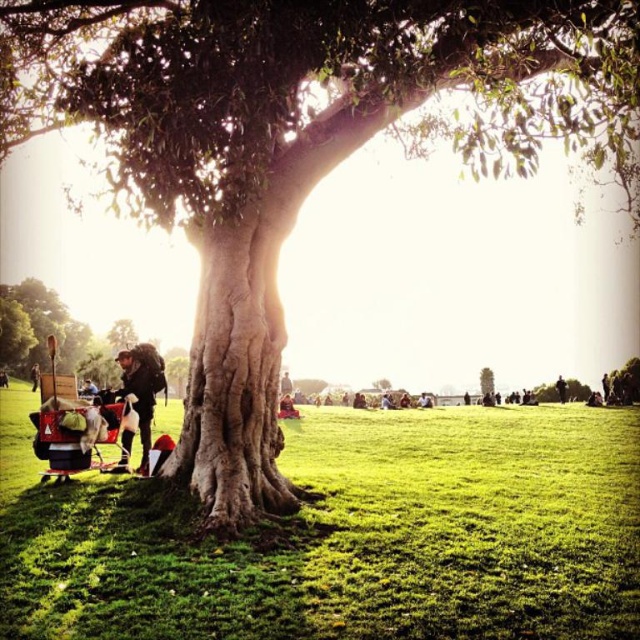
Who is taller, green grass at lower left or green textured tree at center?

With more height is green textured tree at center.

Is green grass at lower left bigger than green textured tree at center?

Yes.

Between point (19, 481) and point (490, 381), which one is positioned behind?

The point (490, 381) is more distant.

Where is `green grass at lower left`? The width and height of the screenshot is (640, 640). green grass at lower left is located at coordinates (346, 536).

Is matte black baby carriage at lower left taller than green mossy tree at lower left?

Incorrect, matte black baby carriage at lower left's height is not larger of green mossy tree at lower left's.

Which is behind, point (42, 422) or point (33, 291)?

Point (33, 291)

Identify the location of matte black baby carriage at lower left. (80, 433).

Can you confirm if green grass at lower left is thinner than matte black backpack at left?

No.

How distant is green grass at lower left from matte black backpack at left?

A distance of 37.58 meters exists between green grass at lower left and matte black backpack at left.

Which is behind, point (472, 472) or point (29, 376)?

The point (29, 376) is behind.

Where is `green grass at lower left`? The image size is (640, 640). green grass at lower left is located at coordinates (346, 536).